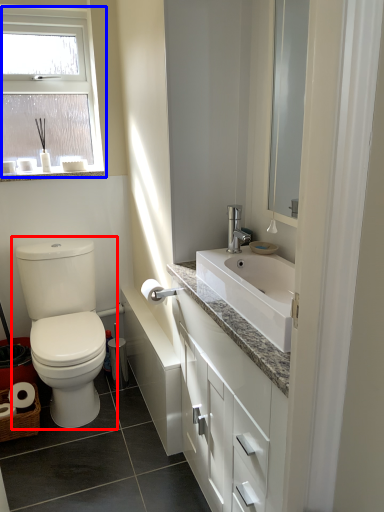
Question: Which object is further to the camera taking this photo, toilet (highlighted by a red box) or window (highlighted by a blue box)?

Choices:
 (A) toilet
 (B) window

Answer: (B)